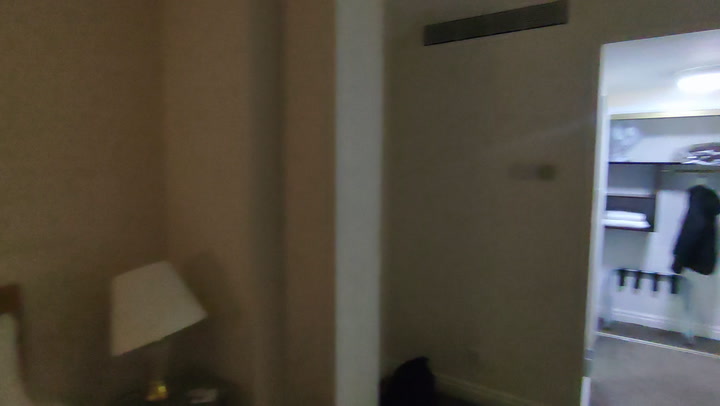
Identify the location of white pillow. (12, 368).